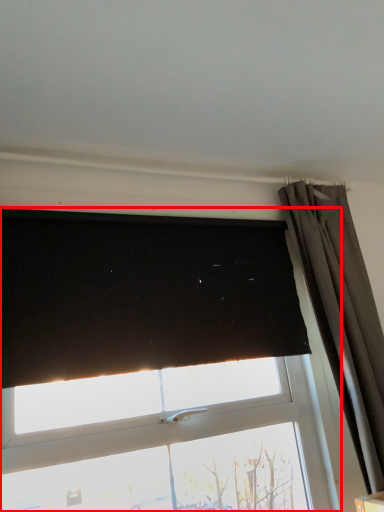
Question: Observing the image, what is the correct spatial positioning of window (annotated by the red box) in reference to curtain?

Choices:
 (A) left
 (B) right

Answer: (A)